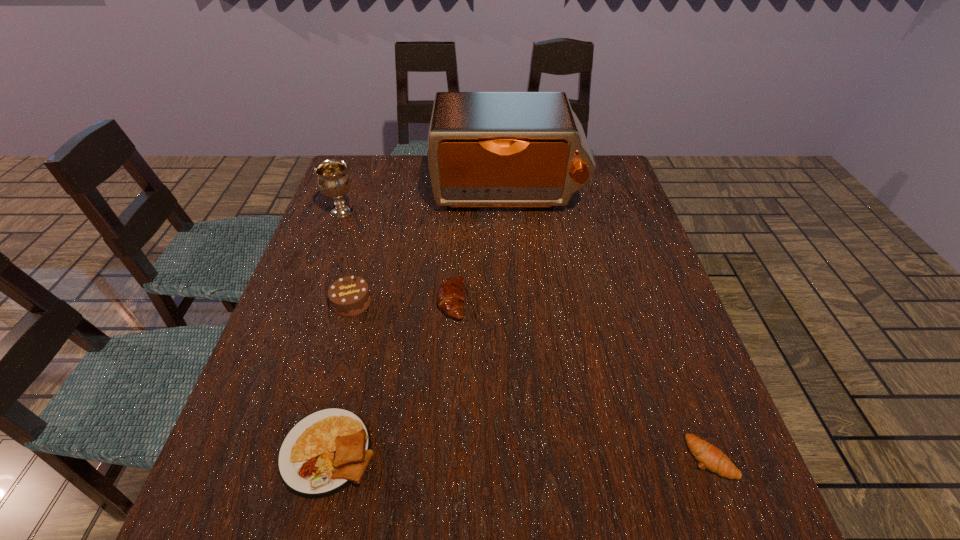
At what (x,y) coordinates should I click in order to perform the action: click on free region located on the front of the leftmost object. Please return your answer as a coordinate pair (x, y). Looking at the image, I should click on (323, 262).

Locate an element on the screen. free point located 0.320m on the front of the chocolate cake is located at coordinates (311, 454).

Image resolution: width=960 pixels, height=540 pixels. Find the location of `free location located on the back of the left crescent roll`. free location located on the back of the left crescent roll is located at coordinates (455, 240).

Find the location of a particular element. The width and height of the screenshot is (960, 540). vacant space positioned 0.280m on the left of the right crescent roll is located at coordinates (535, 457).

I want to click on vacant space located on the right of the omelet, so click(x=580, y=451).

Find the location of a particular element. object present at the far edge is located at coordinates (485, 149).

Where is `object positioned at the near edge`? The width and height of the screenshot is (960, 540). object positioned at the near edge is located at coordinates (322, 454).

The height and width of the screenshot is (540, 960). I want to click on chalice present at the left edge, so click(333, 181).

What are the coordinates of `chocolate cake located at the left edge` in the screenshot? It's located at (349, 296).

Where is `omelet at the left edge`? The height and width of the screenshot is (540, 960). omelet at the left edge is located at coordinates pyautogui.click(x=322, y=454).